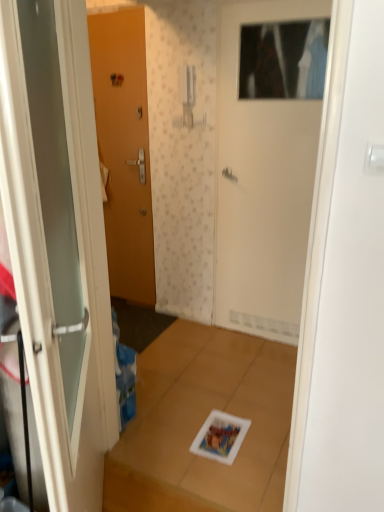
Question: Is white glossy door at left, the 3th door positioned from the back, far away from white matte door at upper center, the 1th door positioned from the right?

Choices:
 (A) yes
 (B) no

Answer: (A)

Question: Is white glossy door at left, the 3th door positioned from the back, positioned behind white matte door at upper center, the 1th door positioned from the right?

Choices:
 (A) no
 (B) yes

Answer: (A)

Question: From a real-world perspective, is white glossy door at left, acting as the second door starting from the left, below white matte door at upper center, the 3th door positioned from the left?

Choices:
 (A) no
 (B) yes

Answer: (B)

Question: Could you tell me if white glossy door at left, the second door viewed from the right, is turned towards white matte door at upper center, the 3th door positioned from the left?

Choices:
 (A) yes
 (B) no

Answer: (B)

Question: Does white glossy door at left, acting as the second door starting from the left, lie in front of white matte door at upper center, the 1th door positioned from the right?

Choices:
 (A) yes
 (B) no

Answer: (A)

Question: Relative to matte wood door at left, which is the third door from front to back, is white matte door at upper center, which is the 2th door in back-to-front order, in front or behind?

Choices:
 (A) behind
 (B) front

Answer: (B)

Question: Considering the positions of white matte door at upper center, the 1th door positioned from the right, and matte wood door at left, the third door when ordered from right to left, in the image, is white matte door at upper center, the 1th door positioned from the right, taller or shorter than matte wood door at left, the third door when ordered from right to left,?

Choices:
 (A) tall
 (B) short

Answer: (B)

Question: Is white matte door at upper center, the 1th door positioned from the right, wider or thinner than matte wood door at left, which ranks as the first door in left-to-right order?

Choices:
 (A) wide
 (B) thin

Answer: (A)

Question: Based on their positions, is white matte door at upper center, the 3th door positioned from the left, located to the left or right of matte wood door at left, which is the third door from front to back?

Choices:
 (A) left
 (B) right

Answer: (B)

Question: Is matte wood door at left, which is the third door from front to back, situated inside white glossy door at left, acting as the second door starting from the left, or outside?

Choices:
 (A) outside
 (B) inside

Answer: (A)

Question: Considering the positions of matte wood door at left, which is the third door from front to back, and white glossy door at left, acting as the second door starting from the left, in the image, is matte wood door at left, which is the third door from front to back, bigger or smaller than white glossy door at left, acting as the second door starting from the left,?

Choices:
 (A) big
 (B) small

Answer: (B)

Question: Considering the positions of matte wood door at left, which is the third door from front to back, and white glossy door at left, acting as the second door starting from the left, in the image, is matte wood door at left, which is the third door from front to back, taller or shorter than white glossy door at left, acting as the second door starting from the left,?

Choices:
 (A) tall
 (B) short

Answer: (A)

Question: Relative to white glossy door at left, the 3th door positioned from the back, is matte wood door at left, positioned as the first door in back-to-front order, in front or behind?

Choices:
 (A) behind
 (B) front

Answer: (A)

Question: Based on their sizes in the image, would you say white glossy door at left, the 3th door positioned from the back, is bigger or smaller than matte wood door at left, positioned as the first door in back-to-front order?

Choices:
 (A) small
 (B) big

Answer: (B)

Question: Looking at their shapes, would you say white glossy door at left, which is the first door from front to back, is wider or thinner than matte wood door at left, the third door when ordered from right to left?

Choices:
 (A) wide
 (B) thin

Answer: (A)